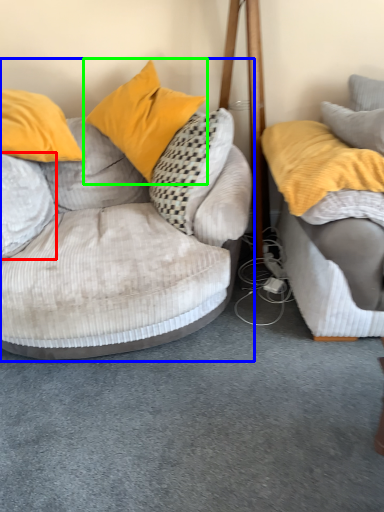
Question: Which object is the closest to the pillow (highlighted by a red box)? Choose among these: studio couch (highlighted by a blue box) or pillow (highlighted by a green box).

Choices:
 (A) studio couch
 (B) pillow

Answer: (A)